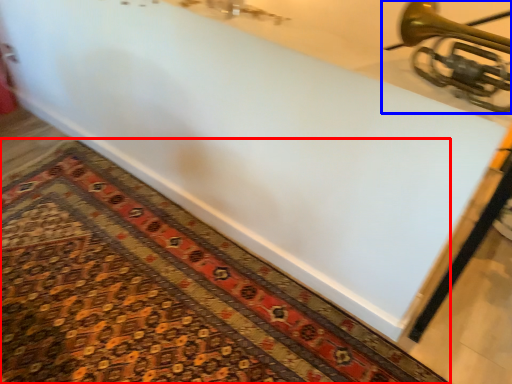
Question: Which object is closer to the camera taking this photo, mat (highlighted by a red box) or musical instrument (highlighted by a blue box)?

Choices:
 (A) mat
 (B) musical instrument

Answer: (B)